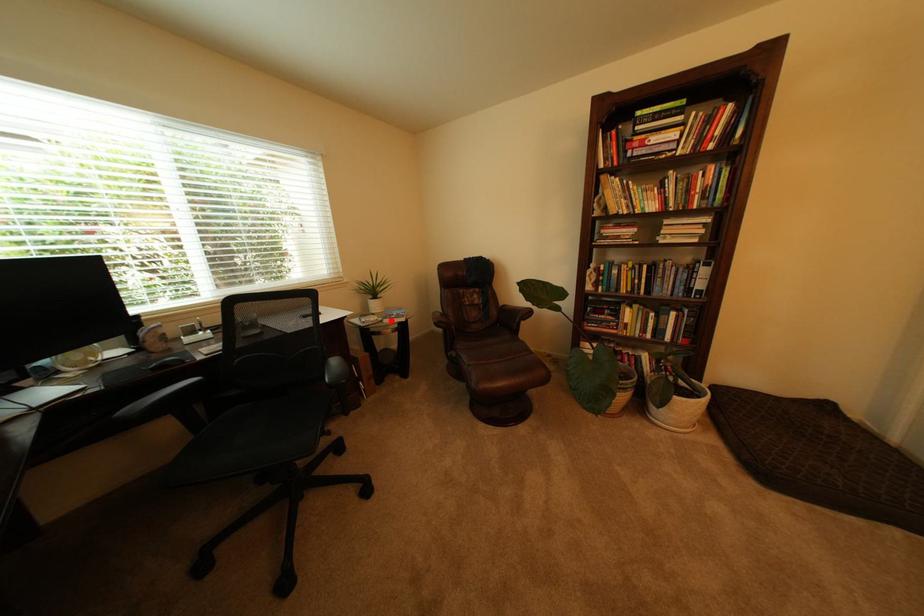
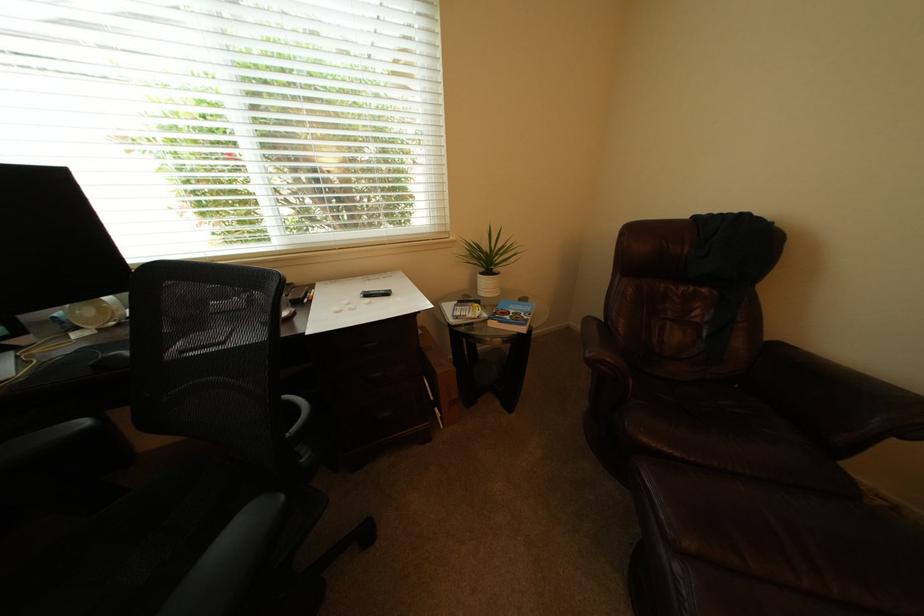
Find the pixel in the second image that matches the highlighted location in the first image.

(495, 317)